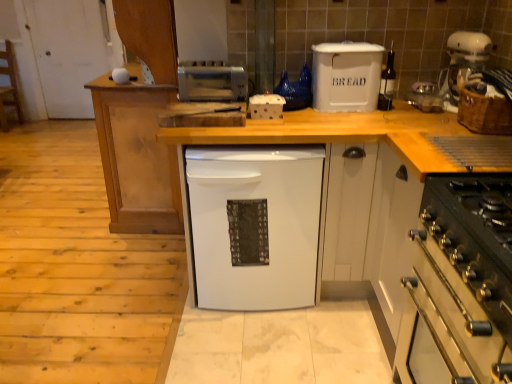
You are a GUI agent. You are given a task and a screenshot of the screen. Output one action in this format:
    pyautogui.click(x=<x>, y=<y>)
    Task: Click on the free point above white plastic bread bin at upper center (from a real-world perspective)
    This screenshot has height=384, width=512.
    Given the screenshot: What is the action you would take?
    pyautogui.click(x=343, y=44)